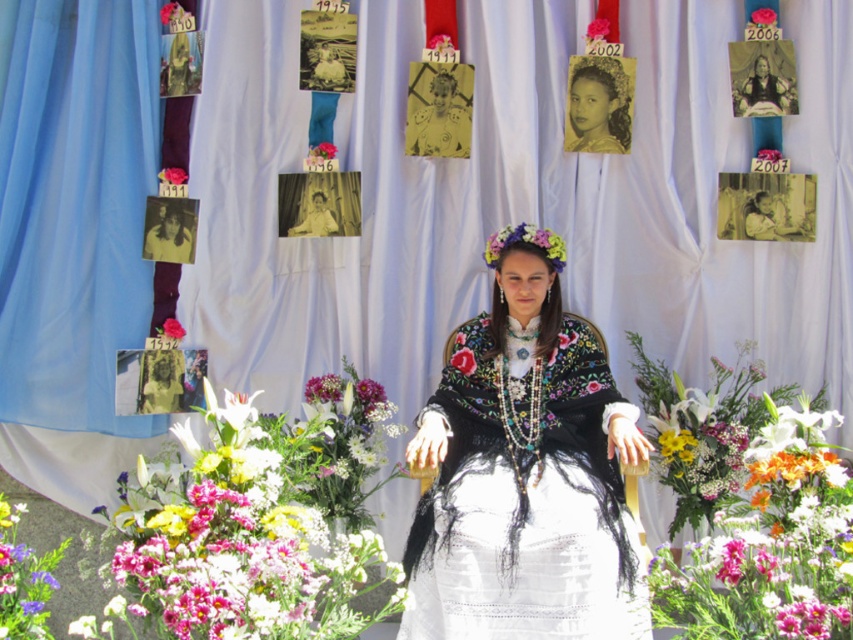
You are planning to place a small decorative item on a table next to the fluffy bouquet of flowers at center and the pink fabric flower at center. Which of the two flowers should you choose if you want to ensure the decorative item is clearly visible without being overshadowed by the larger flower?

You should choose the pink fabric flower at center because the fluffy bouquet of flowers at center is larger in size and would overshadow the decorative item.

You are standing in front of the backdrop with photographs and floral arrangements. You notice two points marked on the backdrop. The first point is at coordinate (215, 502) and the second is at (753, 561). If you were to walk towards the backdrop, which point would you encounter first?

Point (753, 561) would be encountered first because it is in front of point (215, 502) according to their spatial arrangement.

You are a photographer standing at the camera position. You need to adjust the focus to capture the embroidered velvet dress at center clearly. What is the minimum distance you should set the focus to ensure the dress is sharp?

The minimum focus distance should be set to 3.27 meters to ensure the embroidered velvet dress at center is in sharp focus.